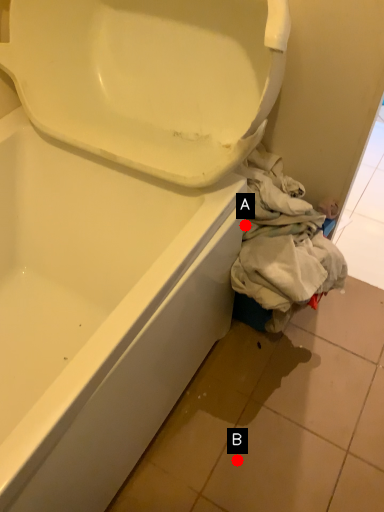
Question: Two points are circled on the image, labeled by A and B beside each circle. Which point is further to the camera?

Choices:
 (A) A is further
 (B) B is further

Answer: (B)